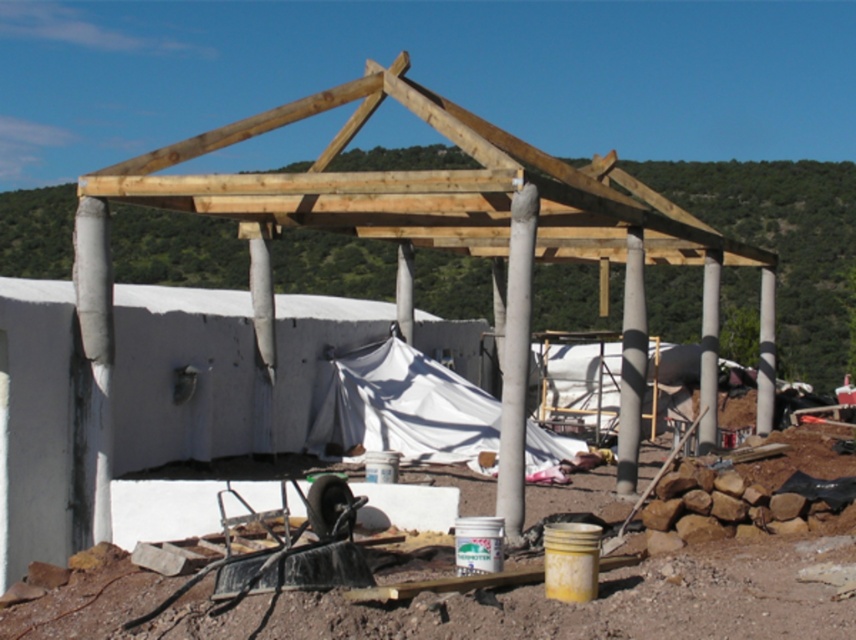
Question: Where is white fabric canopy at center located in relation to gray concrete pole at center in the image?

Choices:
 (A) right
 (B) left

Answer: (B)

Question: Which of these objects is positioned closest to the white fabric canopy at center?

Choices:
 (A) gray concrete pole at center
 (B) smooth concrete pole at center

Answer: (A)

Question: Which point is farther to the camera?

Choices:
 (A) (771, 394)
 (B) (504, 448)

Answer: (A)

Question: Is white fabric canopy at center bigger than gray concrete pole at center?

Choices:
 (A) yes
 (B) no

Answer: (A)

Question: Which of the following is the farthest from the observer?

Choices:
 (A) white fabric canopy at center
 (B) smooth concrete pole at center
 (C) gray concrete pole at center
 (D) white concrete column at center

Answer: (D)

Question: Can you confirm if white fabric canopy at center is thinner than gray concrete pole at center?

Choices:
 (A) yes
 (B) no

Answer: (B)